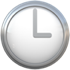
The image size is (70, 70). Identify the location of clock arms. (34, 24), (43, 36).